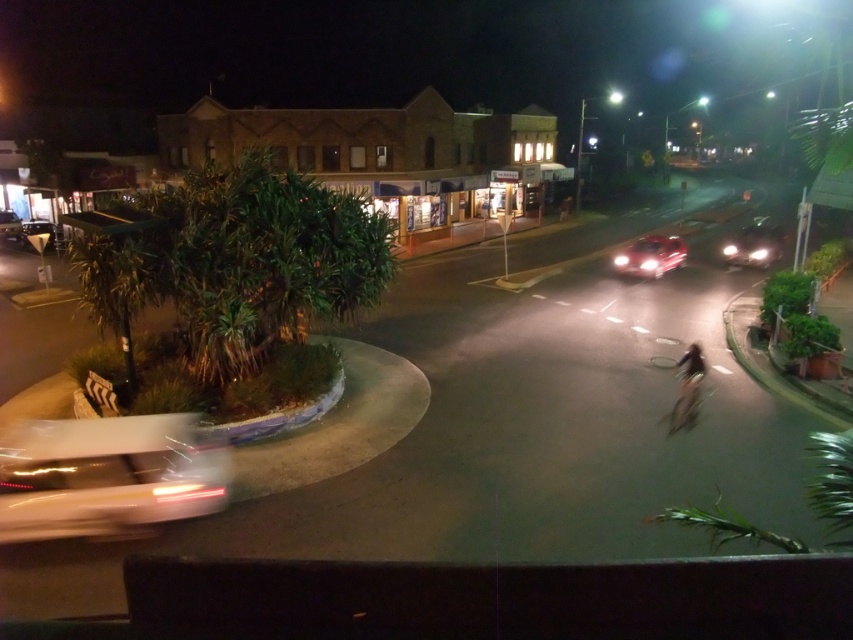
Between point (42, 515) and point (689, 410), which one is positioned in front?

Point (42, 515) is more forward.

Can you confirm if white glossy car at lower left is bigger than shiny metallic bicycle at center-right?

Correct, white glossy car at lower left is larger in size than shiny metallic bicycle at center-right.

The image size is (853, 640). Describe the element at coordinates (107, 474) in the screenshot. I see `white glossy car at lower left` at that location.

Find the location of a particular element. white glossy car at lower left is located at coordinates (107, 474).

Is point (764, 234) closer to viewer compared to point (683, 380)?

That is False.

Which is above, matte silver car at right or shiny metallic bicycle at center-right?

matte silver car at right

Which is in front, point (764, 250) or point (672, 408)?

Point (672, 408) is in front.

The height and width of the screenshot is (640, 853). I want to click on matte silver car at right, so click(753, 244).

Is point (770, 243) more distant than point (693, 372)?

Yes, it is behind point (693, 372).

Identify the location of matte silver car at right. (753, 244).

The width and height of the screenshot is (853, 640). What do you see at coordinates (753, 244) in the screenshot?
I see `matte silver car at right` at bounding box center [753, 244].

This screenshot has height=640, width=853. I want to click on matte silver car at right, so click(753, 244).